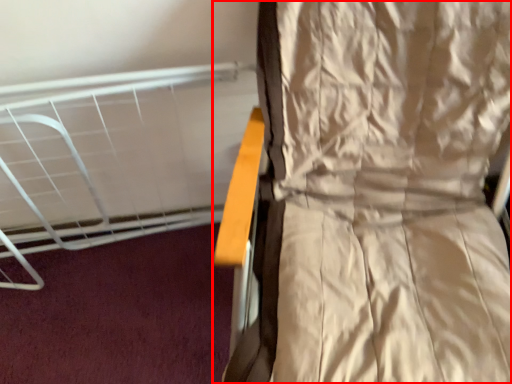
Question: In this image, where is curtain (annotated by the red box) located relative to bed?

Choices:
 (A) left
 (B) right

Answer: (B)